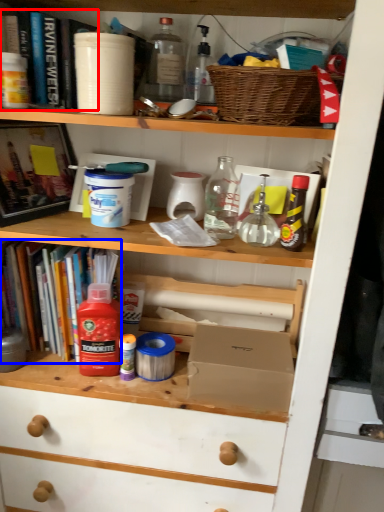
Question: Which object is further to the camera taking this photo, book (highlighted by a red box) or book (highlighted by a blue box)?

Choices:
 (A) book
 (B) book

Answer: (B)